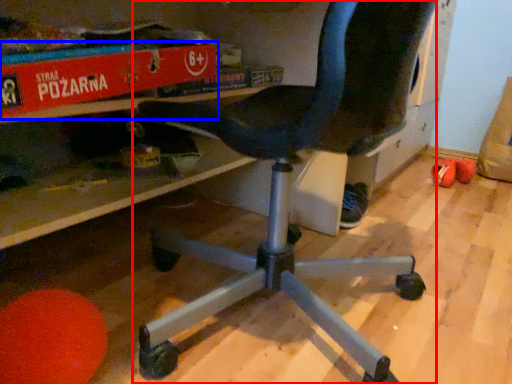
Question: Which object is closer to the camera taking this photo, chair (highlighted by a red box) or paperback book (highlighted by a blue box)?

Choices:
 (A) chair
 (B) paperback book

Answer: (A)